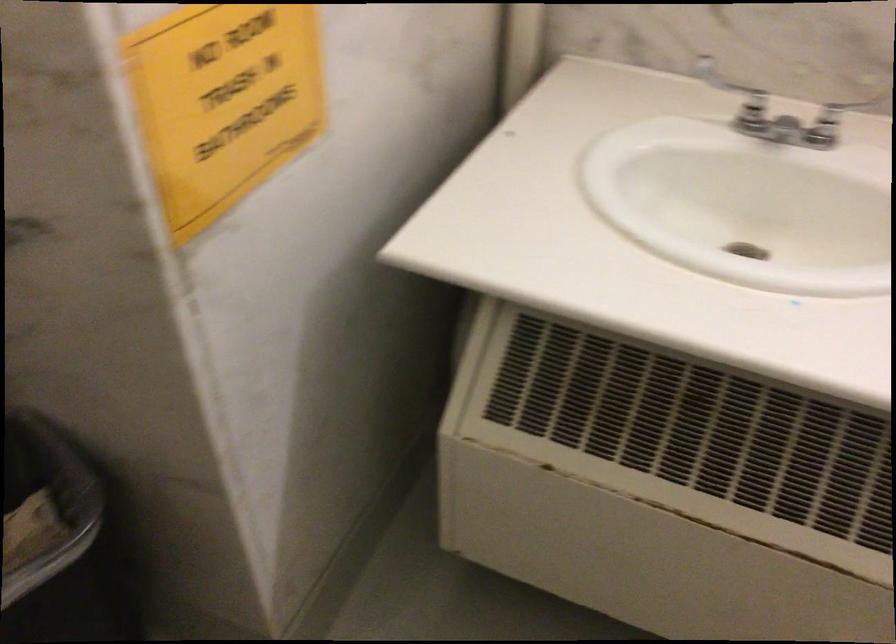
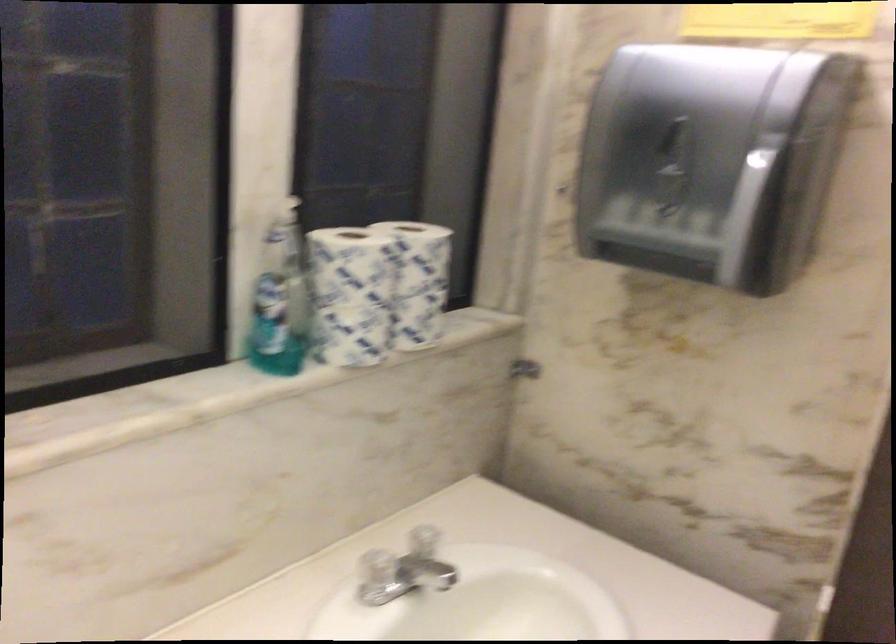
Question: The camera is either moving clockwise (left) or counter-clockwise (right) around the object. The first image is from the beginning of the video and the second image is from the end. Is the camera moving left or right when shooting the video?

Choices:
 (A) Left
 (B) Right

Answer: (A)